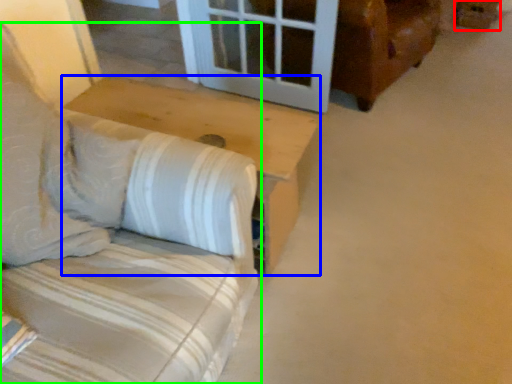
Question: Which is farther away from cardboard box (highlighted by a red box)? table (highlighted by a blue box) or furniture (highlighted by a green box)?

Choices:
 (A) table
 (B) furniture

Answer: (B)